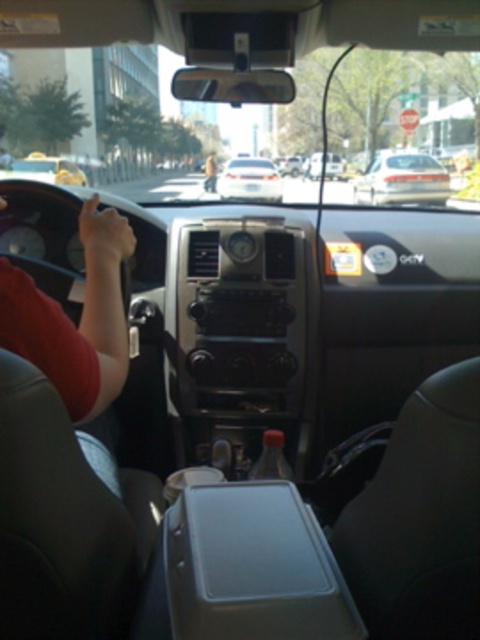
Is point (433, 161) less distant than point (310, 176)?

Yes, it is.

Does white matte sedan at center lie in front of metallic silver car at center?

Yes, white matte sedan at center is closer to the viewer.

Which is in front, point (373, 168) or point (310, 160)?

Point (373, 168) is in front.

This screenshot has height=640, width=480. I want to click on white matte sedan at center, so click(403, 180).

Can you confirm if metallic silver car at center is bigger than light brown leather jacket at center?

Indeed, metallic silver car at center has a larger size compared to light brown leather jacket at center.

Which is above, metallic silver car at center or light brown leather jacket at center?

Positioned higher is metallic silver car at center.

Is point (328, 164) behind point (214, 173)?

Yes, it is.

The width and height of the screenshot is (480, 640). In order to click on metallic silver car at center in this screenshot , I will do `click(324, 164)`.

Does white matte sedan at center appear on the left side of light brown leather jacket at center?

Incorrect, white matte sedan at center is not on the left side of light brown leather jacket at center.

Does white matte sedan at center have a greater height compared to light brown leather jacket at center?

Correct, white matte sedan at center is much taller as light brown leather jacket at center.

What do you see at coordinates (403, 180) in the screenshot?
I see `white matte sedan at center` at bounding box center [403, 180].

Where is `white matte sedan at center`? This screenshot has height=640, width=480. white matte sedan at center is located at coordinates (403, 180).